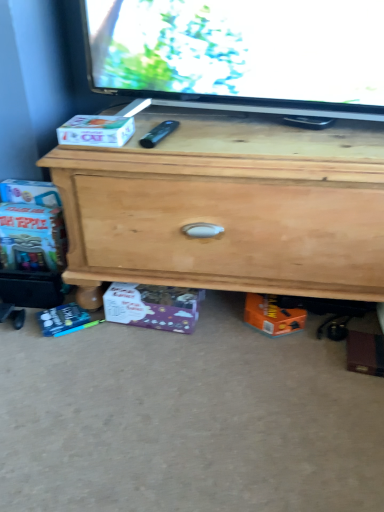
Identify the location of vacant space to the right of purple cardboard box at lower center, acting as the first box starting from the back. Image resolution: width=384 pixels, height=512 pixels. (218, 329).